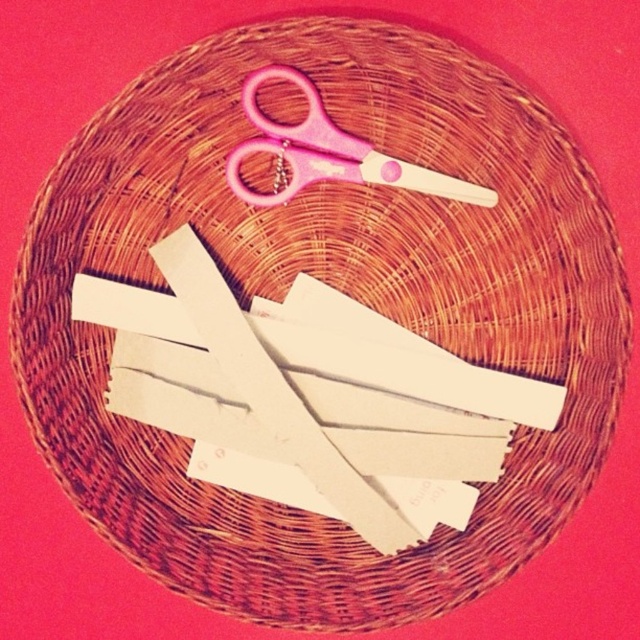
Question: Which object appears farthest from the camera in this image?

Choices:
 (A) pink plastic scissors at upper center
 (B) white paper at center

Answer: (B)

Question: Among these points, which one is nearest to the camera?

Choices:
 (A) (355, 300)
 (B) (232, 172)

Answer: (B)

Question: Is white paper at center positioned in front of pink plastic scissors at upper center?

Choices:
 (A) yes
 (B) no

Answer: (B)

Question: Where is white paper at center located in relation to pink plastic scissors at upper center in the image?

Choices:
 (A) right
 (B) left

Answer: (B)

Question: Where is white paper at center located in relation to pink plastic scissors at upper center in the image?

Choices:
 (A) below
 (B) above

Answer: (A)